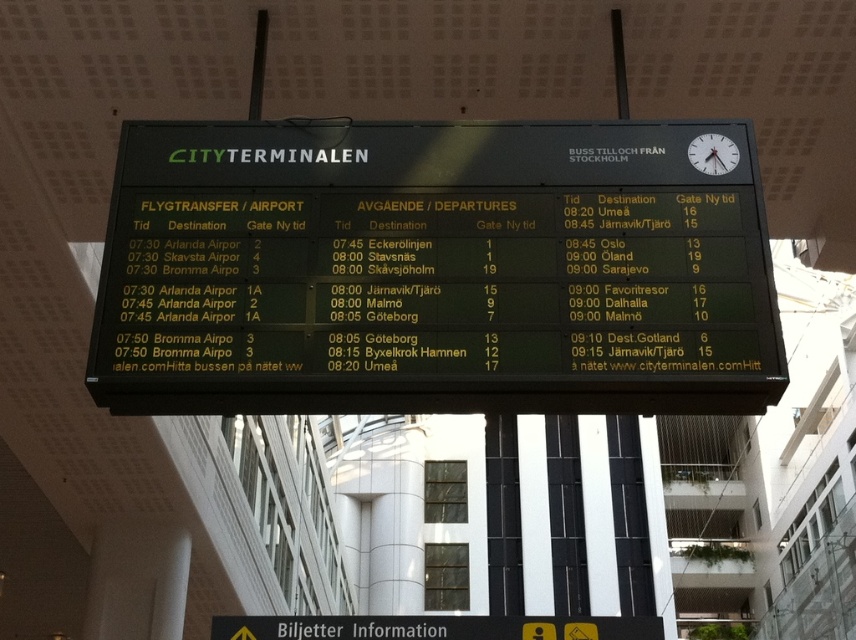
Question: Among these points, which one is farthest from the camera?

Choices:
 (A) (711, 403)
 (B) (709, 157)

Answer: (B)

Question: Does green plastic scoreboard at center appear over white glossy clock at upper right?

Choices:
 (A) no
 (B) yes

Answer: (A)

Question: Observing the image, what is the correct spatial positioning of green plastic scoreboard at center in reference to white glossy clock at upper right?

Choices:
 (A) below
 (B) above

Answer: (A)

Question: In this image, where is green plastic scoreboard at center located relative to white glossy clock at upper right?

Choices:
 (A) above
 (B) below

Answer: (B)